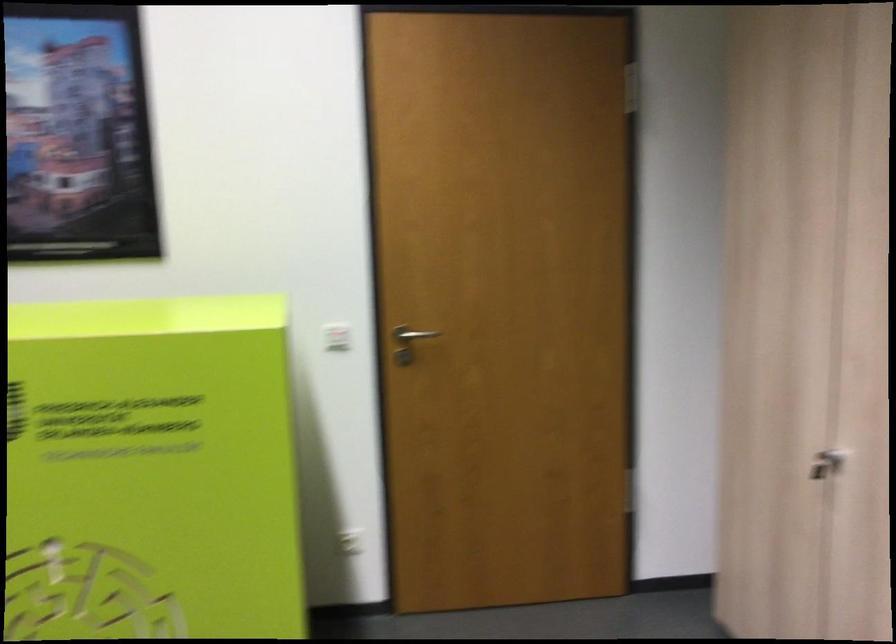
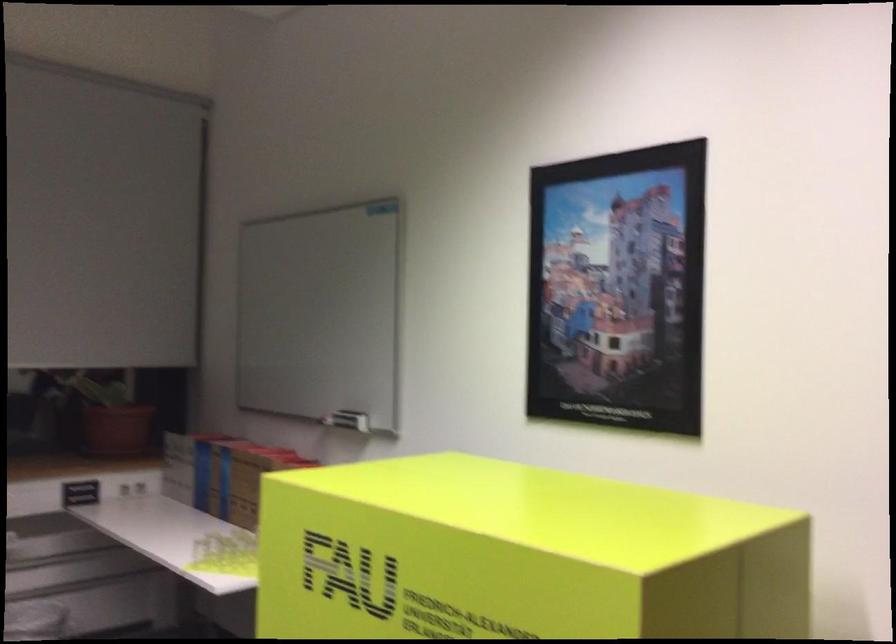
Question: The camera is either moving clockwise (left) or counter-clockwise (right) around the object. The first image is from the beginning of the video and the second image is from the end. Is the camera moving left or right when shooting the video?

Choices:
 (A) Left
 (B) Right

Answer: (B)